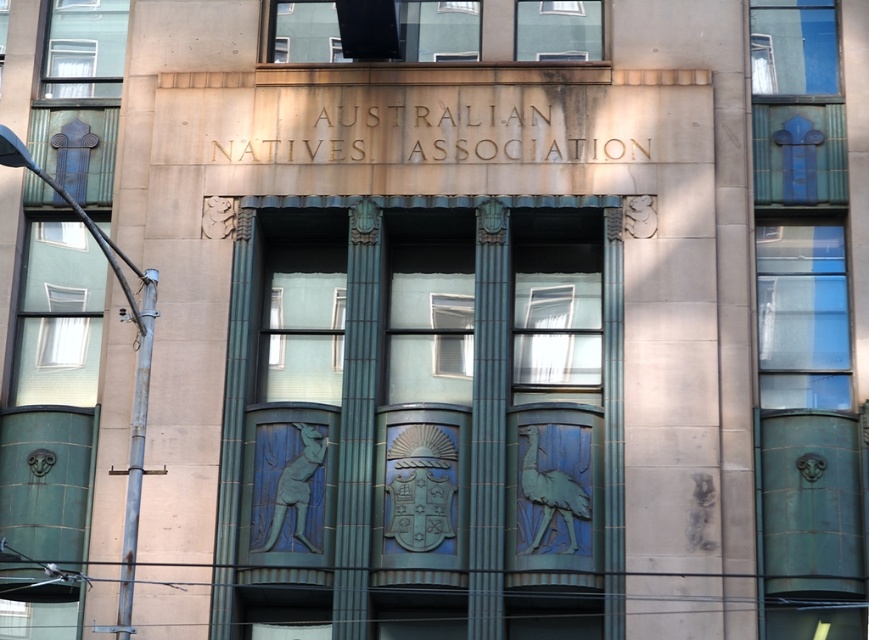
Question: Which of the following is the farthest from the observer?

Choices:
 (A) clear glass window at center
 (B) white glass window at left

Answer: (B)

Question: Which point is farther to the camera?

Choices:
 (A) transparent glass window at upper center
 (B) rusty metal pole at left
 (C) white glass window at left
 (D) blue glazed tiles at center

Answer: (C)

Question: Is blue glazed tiles at center behind white glass window at left?

Choices:
 (A) no
 (B) yes

Answer: (A)

Question: Is clear glass window at center wider than white glass window at left?

Choices:
 (A) yes
 (B) no

Answer: (B)

Question: Observing the image, what is the correct spatial positioning of blue glazed tiles at center in reference to white glass window at left?

Choices:
 (A) left
 (B) right

Answer: (B)

Question: Which is nearer to the clear glass window at center?

Choices:
 (A) transparent glass window at upper center
 (B) white glass window at left
 (C) blue glazed tiles at center

Answer: (C)